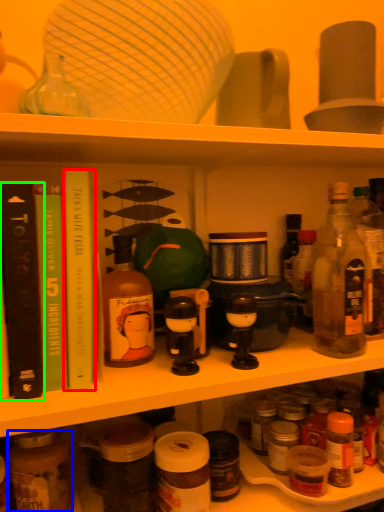
Question: Which object is the closest to the book (highlighted by a red box)? Choose among these: bottle (highlighted by a blue box) or book (highlighted by a green box).

Choices:
 (A) bottle
 (B) book

Answer: (B)